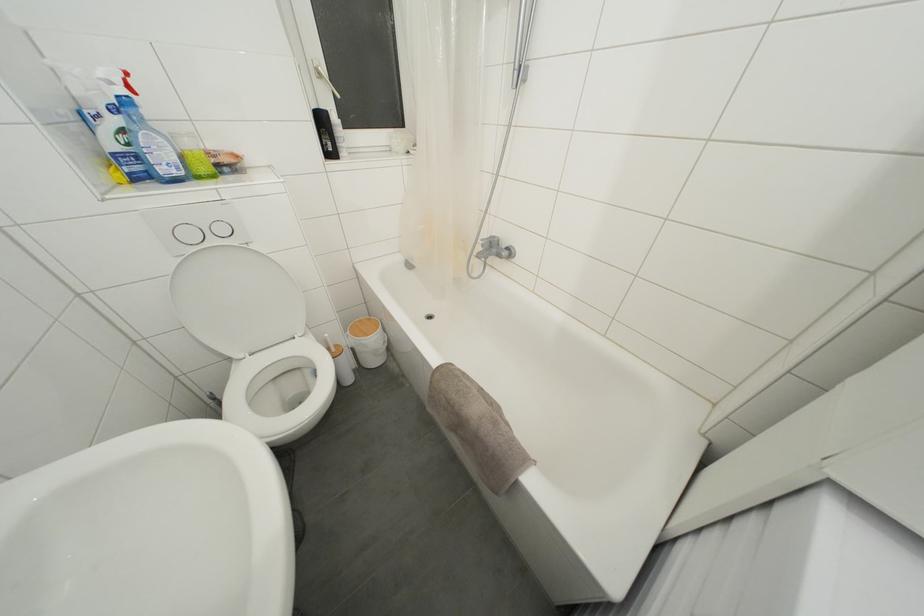
Identify the location of toilet brush handle. (329, 342).